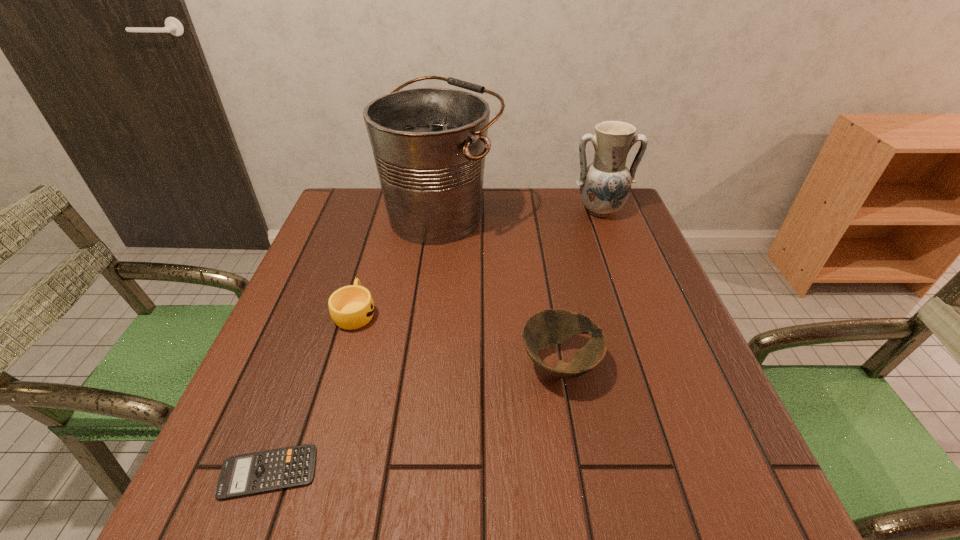
In order to click on object located at the right edge in this screenshot , I will do `click(605, 185)`.

Where is `object situated at the far left corner`? The width and height of the screenshot is (960, 540). object situated at the far left corner is located at coordinates (429, 144).

Where is `object at the near left corner`? object at the near left corner is located at coordinates (259, 472).

Where is `object that is at the far right corner`? object that is at the far right corner is located at coordinates (605, 185).

In the image, there is a desktop. At what (x,y) coordinates should I click in order to perform the action: click on vacant space at the far edge. Please return your answer as a coordinate pair (x, y). The height and width of the screenshot is (540, 960). Looking at the image, I should click on (531, 210).

The width and height of the screenshot is (960, 540). Find the location of `vacant space at the near edge`. vacant space at the near edge is located at coordinates (298, 505).

Image resolution: width=960 pixels, height=540 pixels. In the image, there is a desktop. Identify the location of vacant space at the left edge. (323, 308).

This screenshot has width=960, height=540. Identify the location of vacant space at the right edge of the desktop. (661, 293).

You are a GUI agent. You are given a task and a screenshot of the screen. Output one action in this format:
    pyautogui.click(x=<x>, y=<y>)
    Task: Click on the vacant space at the far left corner of the desktop
    
    Given the screenshot: What is the action you would take?
    coord(363,231)

Locate an element on the screen. The image size is (960, 540). blank area at the far right corner is located at coordinates coord(571,192).